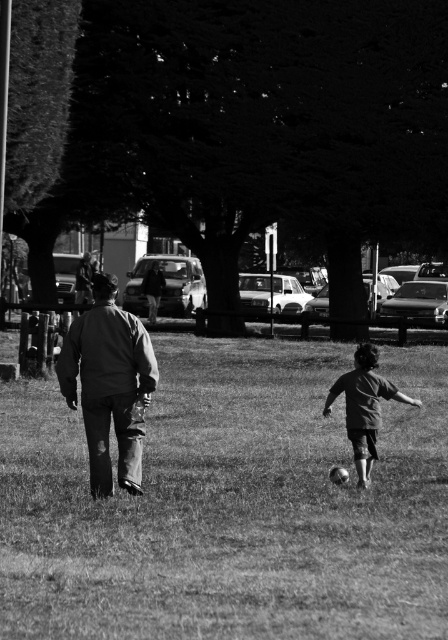
In the scene shown: Is ripped denim jacket at center wider than dark gray cotton shirt at lower right?

Yes.

Does point (90, 428) come closer to viewer compared to point (373, 452)?

That is True.

Identify the location of ripped denim jacket at center. point(108,385).

Which is behind, point (344, 582) or point (374, 403)?

Point (374, 403)

Does point (77, 566) come closer to viewer compared to point (347, 376)?

Yes.

Which is in front, point (377, 632) or point (358, 481)?

Point (377, 632) is more forward.

This screenshot has height=640, width=448. I want to click on grassy at center, so click(229, 506).

Is point (396, 620) farther from camera compared to point (138, 337)?

No, it is not.

Does grassy at center have a greater width compared to ripped denim jacket at center?

Yes.

The width and height of the screenshot is (448, 640). What do you see at coordinates (229, 506) in the screenshot?
I see `grassy at center` at bounding box center [229, 506].

You are a GUI agent. You are given a task and a screenshot of the screen. Output one action in this format:
    pyautogui.click(x=<x>, y=<y>)
    Task: Click on the grassy at center
    The image size is (448, 640).
    Given the screenshot: What is the action you would take?
    (229, 506)